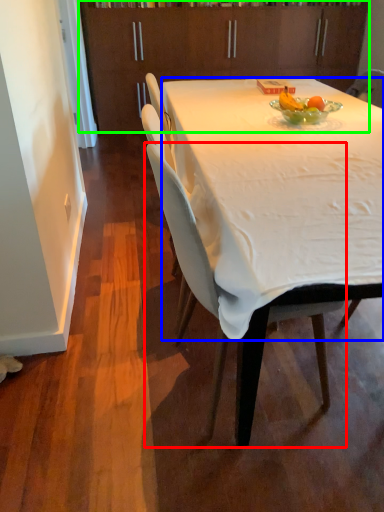
Question: Estimate the real-world distances between objects in this image. Which object is farther from chair (highlighted by a red box), desk (highlighted by a blue box) or cabinetry (highlighted by a green box)?

Choices:
 (A) desk
 (B) cabinetry

Answer: (B)